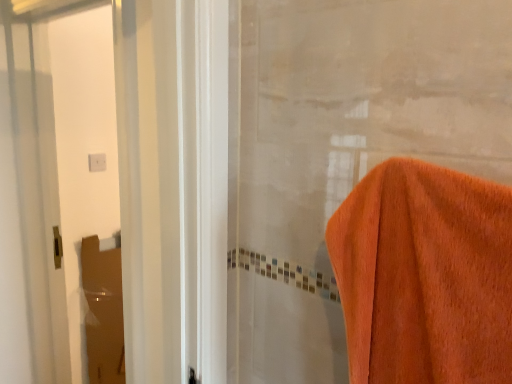
What is the approximate width of brown cardboard at left, the first screen door when ordered from back to front?

The width of brown cardboard at left, the first screen door when ordered from back to front, is 6.88 centimeters.

Describe the element at coordinates (103, 312) in the screenshot. I see `brown cardboard at left, the first screen door when ordered from back to front` at that location.

You are a GUI agent. You are given a task and a screenshot of the screen. Output one action in this format:
    pyautogui.click(x=<x>, y=<y>)
    Task: Click on the brown cardboard at left, the first screen door when ordered from back to front
    
    Given the screenshot: What is the action you would take?
    pyautogui.click(x=103, y=312)

This screenshot has width=512, height=384. I want to click on clear glass screen door at left, the 2th screen door when ordered from back to front, so click(x=82, y=145).

This screenshot has height=384, width=512. What do you see at coordinates (82, 145) in the screenshot?
I see `clear glass screen door at left, acting as the 1th screen door starting from the front` at bounding box center [82, 145].

The height and width of the screenshot is (384, 512). Find the location of `brown cardboard at left, the first screen door when ordered from back to front`. brown cardboard at left, the first screen door when ordered from back to front is located at coordinates (103, 312).

Considering the relative positions of brown cardboard at left, the 2th screen door in the front-to-back sequence, and clear glass screen door at left, acting as the 1th screen door starting from the front, in the image provided, is brown cardboard at left, the 2th screen door in the front-to-back sequence, to the left or to the right of clear glass screen door at left, acting as the 1th screen door starting from the front,?

brown cardboard at left, the 2th screen door in the front-to-back sequence, is positioned on clear glass screen door at left, acting as the 1th screen door starting from the front,'s left side.

Does brown cardboard at left, the 2th screen door in the front-to-back sequence, lie in front of clear glass screen door at left, the 2th screen door when ordered from back to front?

No.

Is point (116, 319) positioned after point (97, 87)?

Yes, it is.

From the image's perspective, which is above, brown cardboard at left, the first screen door when ordered from back to front, or clear glass screen door at left, acting as the 1th screen door starting from the front?

clear glass screen door at left, acting as the 1th screen door starting from the front, from the image's perspective.

From a real-world perspective, who is located higher, brown cardboard at left, the 2th screen door in the front-to-back sequence, or clear glass screen door at left, the 2th screen door when ordered from back to front?

In real-world perspective, clear glass screen door at left, the 2th screen door when ordered from back to front, is above.

Between brown cardboard at left, the 2th screen door in the front-to-back sequence, and clear glass screen door at left, the 2th screen door when ordered from back to front, which one has larger width?

clear glass screen door at left, the 2th screen door when ordered from back to front.

Is brown cardboard at left, the 2th screen door in the front-to-back sequence, taller than clear glass screen door at left, acting as the 1th screen door starting from the front?

No, brown cardboard at left, the 2th screen door in the front-to-back sequence, is not taller than clear glass screen door at left, acting as the 1th screen door starting from the front.

Based on their sizes in the image, would you say brown cardboard at left, the first screen door when ordered from back to front, is bigger or smaller than clear glass screen door at left, acting as the 1th screen door starting from the front?

Considering their sizes, brown cardboard at left, the first screen door when ordered from back to front, takes up less space than clear glass screen door at left, acting as the 1th screen door starting from the front.

Is brown cardboard at left, the 2th screen door in the front-to-back sequence, inside the boundaries of clear glass screen door at left, acting as the 1th screen door starting from the front, or outside?

brown cardboard at left, the 2th screen door in the front-to-back sequence, exists outside the volume of clear glass screen door at left, acting as the 1th screen door starting from the front.

Is brown cardboard at left, the 2th screen door in the front-to-back sequence, with clear glass screen door at left, the 2th screen door when ordered from back to front?

No, brown cardboard at left, the 2th screen door in the front-to-back sequence, is not beside clear glass screen door at left, the 2th screen door when ordered from back to front.

Is brown cardboard at left, the 2th screen door in the front-to-back sequence, aimed at clear glass screen door at left, acting as the 1th screen door starting from the front?

No.

How many degrees apart are the facing directions of brown cardboard at left, the 2th screen door in the front-to-back sequence, and clear glass screen door at left, acting as the 1th screen door starting from the front?

The facing directions of brown cardboard at left, the 2th screen door in the front-to-back sequence, and clear glass screen door at left, acting as the 1th screen door starting from the front, are 89.3 degrees apart.

The width and height of the screenshot is (512, 384). I want to click on screen door behind the clear glass screen door at left, the 2th screen door when ordered from back to front, so click(x=103, y=312).

Is clear glass screen door at left, acting as the 1th screen door starting from the front, to the right of brown cardboard at left, the first screen door when ordered from back to front, from the viewer's perspective?

Yes.

Relative to brown cardboard at left, the first screen door when ordered from back to front, is clear glass screen door at left, the 2th screen door when ordered from back to front, in front or behind?

Visually, clear glass screen door at left, the 2th screen door when ordered from back to front, is located in front of brown cardboard at left, the first screen door when ordered from back to front.

Considering the points (65, 85) and (83, 260), which point is in front, point (65, 85) or point (83, 260)?

The point (65, 85) is closer.

From the image's perspective, is clear glass screen door at left, acting as the 1th screen door starting from the front, located above brown cardboard at left, the 2th screen door in the front-to-back sequence?

Yes, from the image's perspective, clear glass screen door at left, acting as the 1th screen door starting from the front, is above brown cardboard at left, the 2th screen door in the front-to-back sequence.

From a real-world perspective, between clear glass screen door at left, acting as the 1th screen door starting from the front, and brown cardboard at left, the 2th screen door in the front-to-back sequence, who is vertically higher?

From a 3D spatial view, clear glass screen door at left, acting as the 1th screen door starting from the front, is above.

Considering the relative sizes of clear glass screen door at left, acting as the 1th screen door starting from the front, and brown cardboard at left, the 2th screen door in the front-to-back sequence, in the image provided, is clear glass screen door at left, acting as the 1th screen door starting from the front, thinner than brown cardboard at left, the 2th screen door in the front-to-back sequence,?

In fact, clear glass screen door at left, acting as the 1th screen door starting from the front, might be wider than brown cardboard at left, the 2th screen door in the front-to-back sequence.

Can you confirm if clear glass screen door at left, acting as the 1th screen door starting from the front, is taller than brown cardboard at left, the first screen door when ordered from back to front?

Yes.

Can you confirm if clear glass screen door at left, the 2th screen door when ordered from back to front, is smaller than brown cardboard at left, the first screen door when ordered from back to front?

Actually, clear glass screen door at left, the 2th screen door when ordered from back to front, might be larger than brown cardboard at left, the first screen door when ordered from back to front.

Is clear glass screen door at left, the 2th screen door when ordered from back to front, not inside brown cardboard at left, the 2th screen door in the front-to-back sequence?

Yes.

Based on the photo, is clear glass screen door at left, the 2th screen door when ordered from back to front, with brown cardboard at left, the 2th screen door in the front-to-back sequence?

No.

Is clear glass screen door at left, acting as the 1th screen door starting from the front, positioned with its back to brown cardboard at left, the 2th screen door in the front-to-back sequence?

Yes, clear glass screen door at left, acting as the 1th screen door starting from the front,'s orientation is away from brown cardboard at left, the 2th screen door in the front-to-back sequence.

What's the angular difference between clear glass screen door at left, acting as the 1th screen door starting from the front, and brown cardboard at left, the 2th screen door in the front-to-back sequence,'s facing directions?

The angular difference between clear glass screen door at left, acting as the 1th screen door starting from the front, and brown cardboard at left, the 2th screen door in the front-to-back sequence, is 89.3 degrees.

The width and height of the screenshot is (512, 384). I want to click on screen door in front of the brown cardboard at left, the first screen door when ordered from back to front, so click(x=82, y=145).

This screenshot has width=512, height=384. I want to click on screen door located below the clear glass screen door at left, acting as the 1th screen door starting from the front (from the image's perspective), so click(x=103, y=312).

Locate an element on the screen. screen door positioned vertically above the brown cardboard at left, the first screen door when ordered from back to front (from a real-world perspective) is located at coordinates (82, 145).